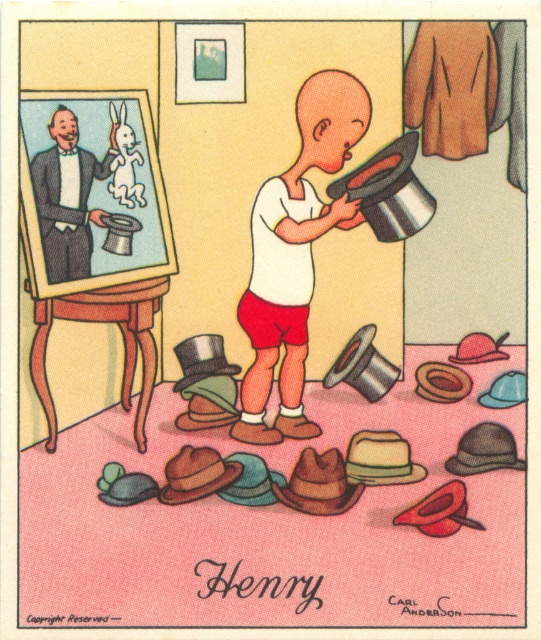
You are standing in Henrys room and want to place a new painting on the wall near the brushed wood easel at upper left. Can you tell me the exact coordinates where the easel is located?

The brushed wood easel at upper left is located at point (94, 228).

Henry is trying to decide which hat to wear with his smooth black suit at left. He has a shiny silver top hat at center to choose from. Which item is bigger?

The smooth black suit at left is larger in size than the shiny silver top hat at center.

You are a painter standing in front of the brushed wood easel at upper left and the white matte shirt at center. Which object is shorter?

The brushed wood easel at upper left is shorter than the white matte shirt at center.